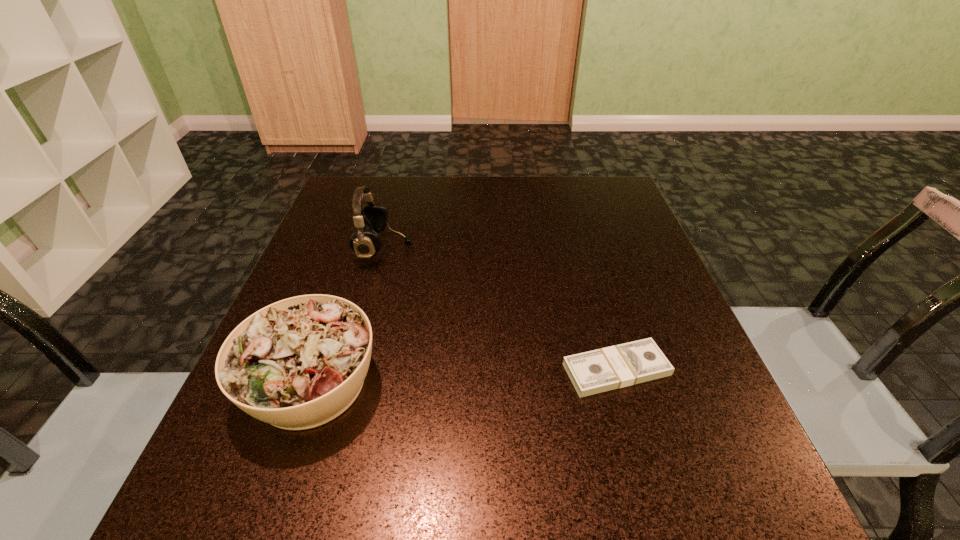
In order to click on vacant region that satisfies the following two spatial constraints: 1. on the back side of the dollar; 2. with the microphone on the side of the headset in this screenshot , I will do `click(582, 247)`.

Locate an element on the screen. vacant space that satisfies the following two spatial constraints: 1. with the microphone on the side of the rightmost object; 2. on the right side of the headset is located at coordinates (351, 369).

Locate an element on the screen. This screenshot has height=540, width=960. free point that satisfies the following two spatial constraints: 1. with the microphone on the side of the farthest object; 2. on the back side of the dollar is located at coordinates (351, 369).